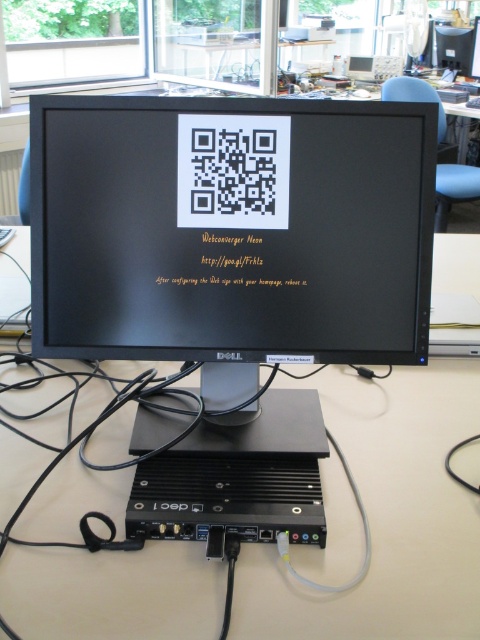
You are setting up a new workstation and need to ensure that the black glossy monitor at center and the black plastic computer at lower center are spaced correctly according to safety guidelines. The minimum recommended distance between a monitor and a computer is 8 inches. Is the current spacing between them compliant with this requirement?

The black glossy monitor at center is 8.72 inches away from the black plastic computer at lower center. Since 8.72 inches exceeds the minimum recommended distance of 8 inches, the current spacing is compliant with safety guidelines.

What object is located at the coordinates point (x=230, y=232) in the workspace setup?

The point (x=230, y=232) indicates the location of the black glossy monitor at center.

You are setting up a new workstation and need to place a keyboard between the black glossy monitor at center and the black plastic computer at lower center. According to the setup, where should you position the keyboard?

The black glossy monitor at center is positioned over the black plastic computer at lower center, so the keyboard should be placed below the black plastic computer at lower center to ensure it is accessible for use.